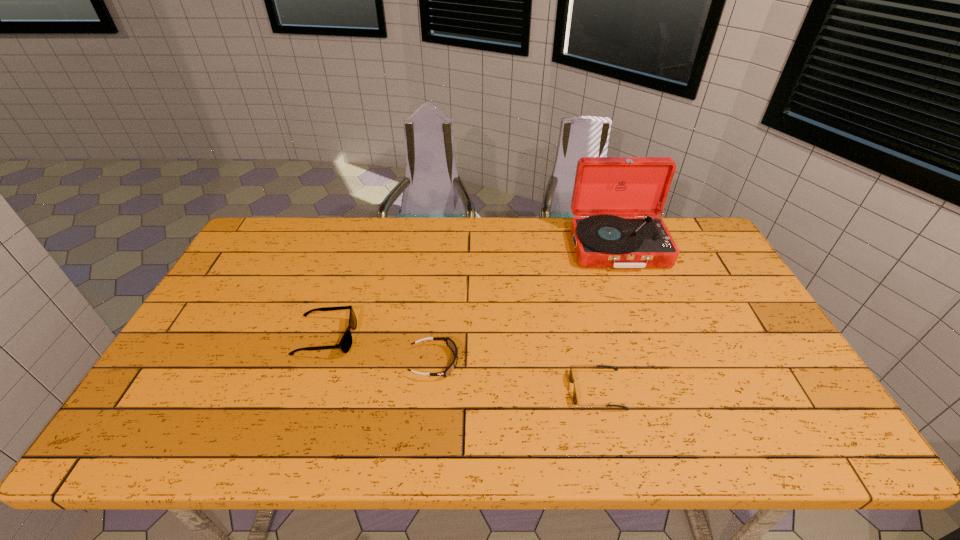
What are the coordinates of `free space between the farthest object and the goggles` in the screenshot? It's located at (526, 305).

Locate which object is the third closest to the leftmost object. Please provide its 2D coordinates. Your answer should be formatted as a tuple, i.e. [(x, y)], where the tuple contains the x and y coordinates of a point satisfying the conditions above.

[(605, 187)]

Point out which object is positioned as the third nearest to the goggles. Please provide its 2D coordinates. Your answer should be formatted as a tuple, i.e. [(x, y)], where the tuple contains the x and y coordinates of a point satisfying the conditions above.

[(605, 187)]

At what (x,y) coordinates should I click in order to perform the action: click on free point that satisfies the following two spatial constraints: 1. on the front-facing side of the phonograph_record; 2. on the front and sides of the second object from left to right. Please return your answer as a coordinate pair (x, y). Image resolution: width=960 pixels, height=540 pixels. Looking at the image, I should click on (661, 362).

This screenshot has height=540, width=960. I want to click on vacant area that satisfies the following two spatial constraints: 1. on the front-facing side of the phonograph_record; 2. on the front-facing side of the shorter sunglasses, so click(x=672, y=390).

The width and height of the screenshot is (960, 540). Find the location of `vacant area that satisfies the following two spatial constraints: 1. on the front-facing side of the tallest object; 2. on the front-facing side of the leftmost object`. vacant area that satisfies the following two spatial constraints: 1. on the front-facing side of the tallest object; 2. on the front-facing side of the leftmost object is located at coordinates (652, 338).

The width and height of the screenshot is (960, 540). In order to click on blank space that satisfies the following two spatial constraints: 1. on the front-facing side of the phonograph_record; 2. on the front-facing side of the taller sunglasses in this screenshot , I will do `click(652, 338)`.

Locate an element on the screen. vacant space that satisfies the following two spatial constraints: 1. on the front-facing side of the tallest object; 2. on the front-facing side of the left sunglasses is located at coordinates (652, 338).

You are a GUI agent. You are given a task and a screenshot of the screen. Output one action in this format:
    pyautogui.click(x=<x>, y=<y>)
    Task: Click on the free space that satisfies the following two spatial constraints: 1. on the front-facing side of the farthest object; 2. on the front-facing side of the left sunglasses
    
    Given the screenshot: What is the action you would take?
    pyautogui.click(x=652, y=338)

Identify the location of free space that satisfies the following two spatial constraints: 1. on the front-facing side of the tallest object; 2. on the front-facing side of the nearer sunglasses. The height and width of the screenshot is (540, 960). (672, 390).